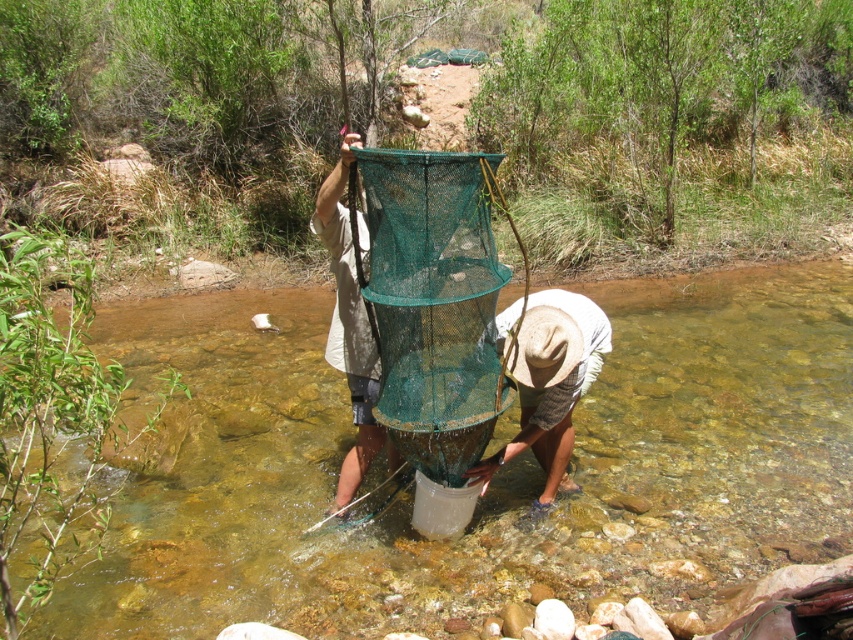
Question: Observing the image, what is the correct spatial positioning of clear water at center in reference to light brown straw hat at lower center?

Choices:
 (A) below
 (B) above

Answer: (A)

Question: Which point is farther from the camera taking this photo?

Choices:
 (A) (550, 336)
 (B) (287, 593)

Answer: (B)

Question: Does clear water at center lie behind light brown straw hat at lower center?

Choices:
 (A) yes
 (B) no

Answer: (A)

Question: Which object is farther from the camera taking this photo?

Choices:
 (A) green mesh net at center
 (B) light brown straw hat at lower center

Answer: (B)

Question: Does clear water at center have a smaller size compared to light brown straw hat at lower center?

Choices:
 (A) no
 (B) yes

Answer: (B)

Question: Which of these objects is positioned farthest from the green mesh net at center?

Choices:
 (A) light brown straw hat at lower center
 (B) clear water at center

Answer: (B)